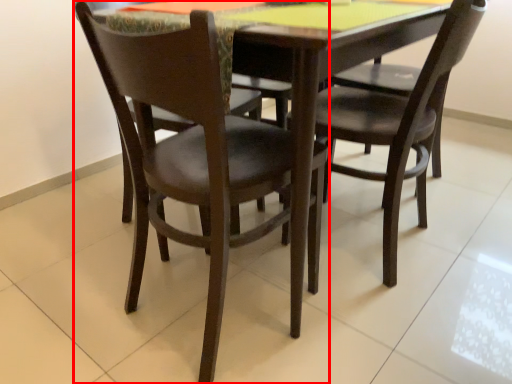
Question: Observing the image, what is the correct spatial positioning of chair (annotated by the red box) in reference to chair?

Choices:
 (A) left
 (B) right

Answer: (A)